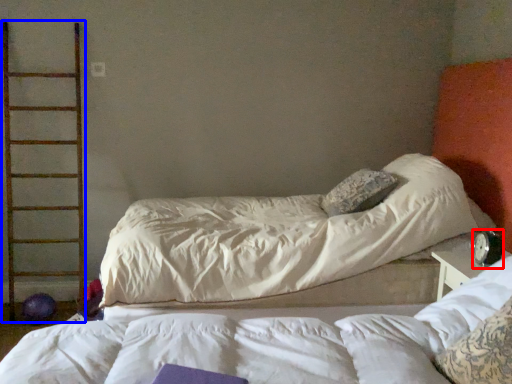
Question: Which object appears farthest to the camera in this image, alarm clock (highlighted by a red box) or ladder (highlighted by a blue box)?

Choices:
 (A) alarm clock
 (B) ladder

Answer: (B)